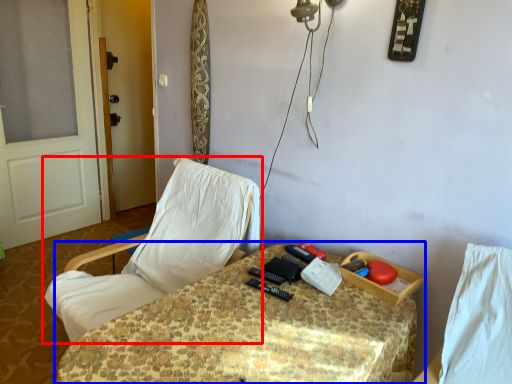
Question: Among these objects, which one is nearest to the camera, chair (highlighted by a red box) or table (highlighted by a blue box)?

Choices:
 (A) chair
 (B) table

Answer: (B)